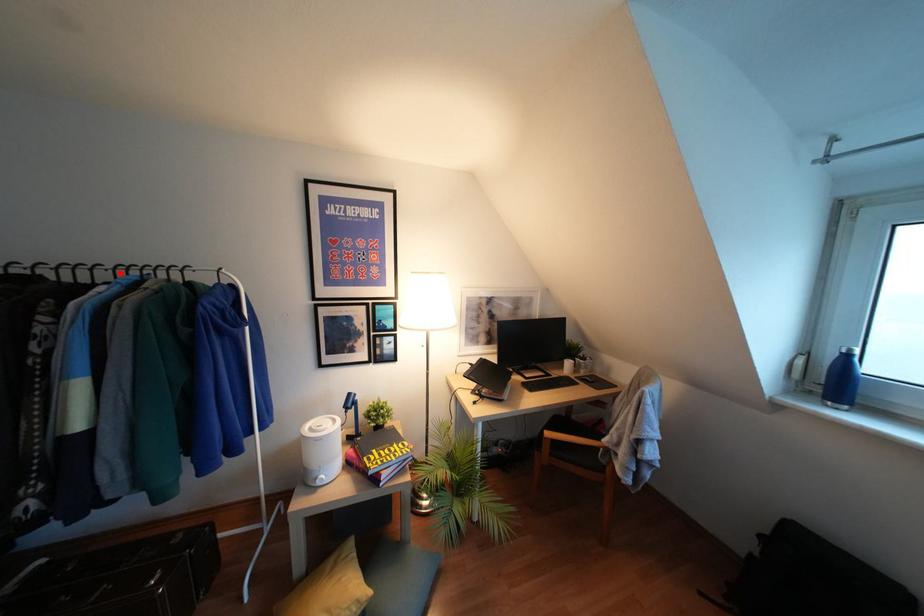
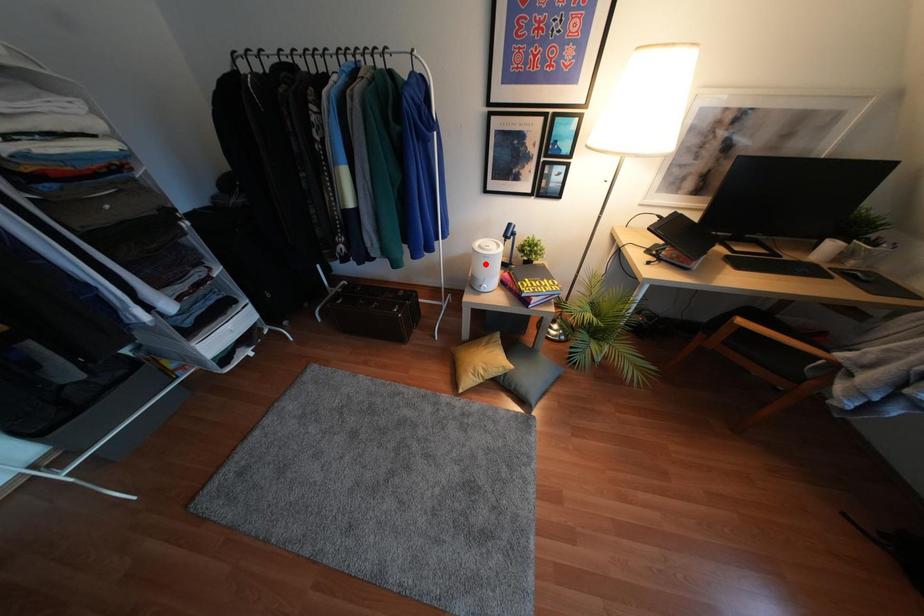
From the picture: I am providing you with two images of the same scene from different viewpoints. A red point is marked on the first image and another point is marked on the second image. Is the marked point in image1 the same physical position as the marked point in image2?

No